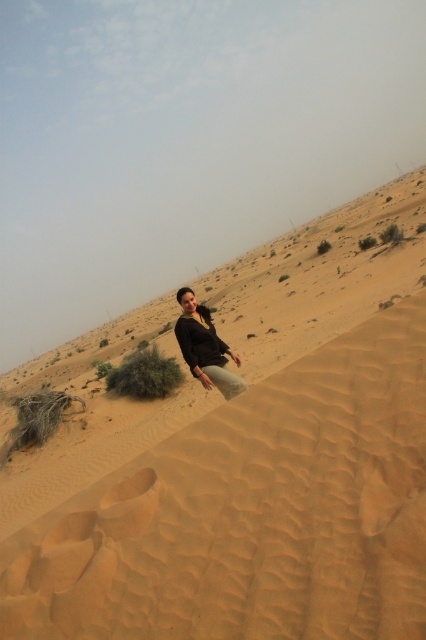
Is sandy textured desert at center further to camera compared to matte black top at center?

No.

Does sandy textured desert at center come in front of matte black top at center?

Yes, it is.

Who is more distant from viewer, [374,218] or [203,358]?

Positioned behind is point [374,218].

Identify the location of sandy textured desert at center. This screenshot has height=640, width=426. (241, 458).